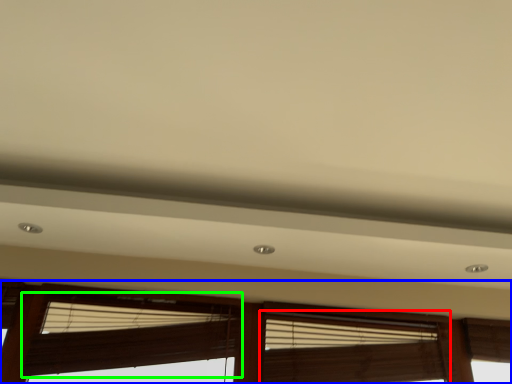
Question: Which object is positioned closest to window blind (highlighted by a red box)? Select from window (highlighted by a blue box) and window blind (highlighted by a green box).

Choices:
 (A) window
 (B) window blind

Answer: (A)